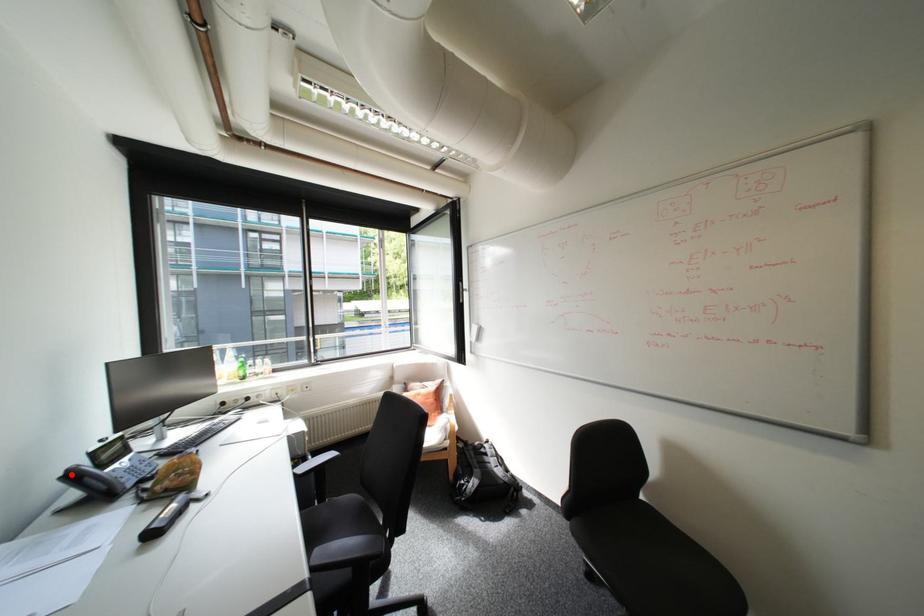
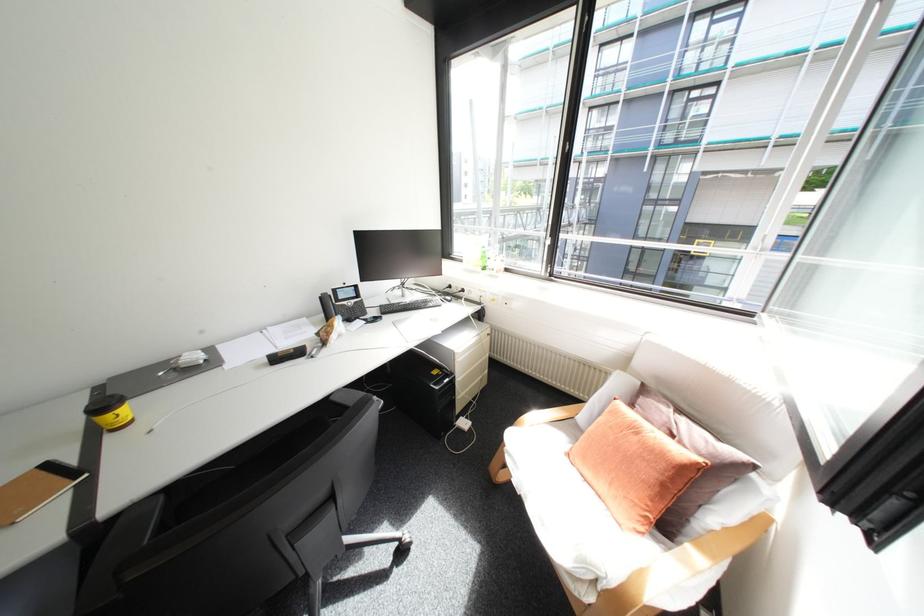
Question: I am providing you with two images of the same scene from different viewpoints. In image1, a red point is highlighted. Considering the same 3D point in image2, which of the following is correct?

Choices:
 (A) It is closer
 (B) It is farther

Answer: (B)